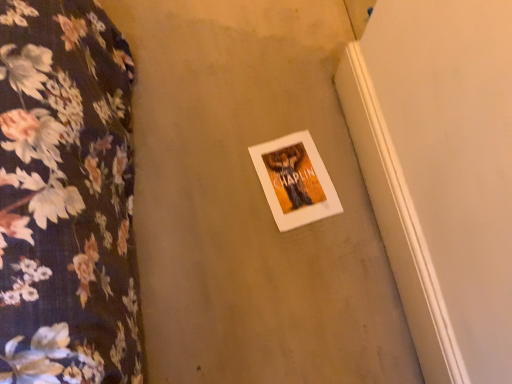
Image resolution: width=512 pixels, height=384 pixels. What are the coordinates of `vacant space situated on the left part of white paper at center` in the screenshot? It's located at (216, 174).